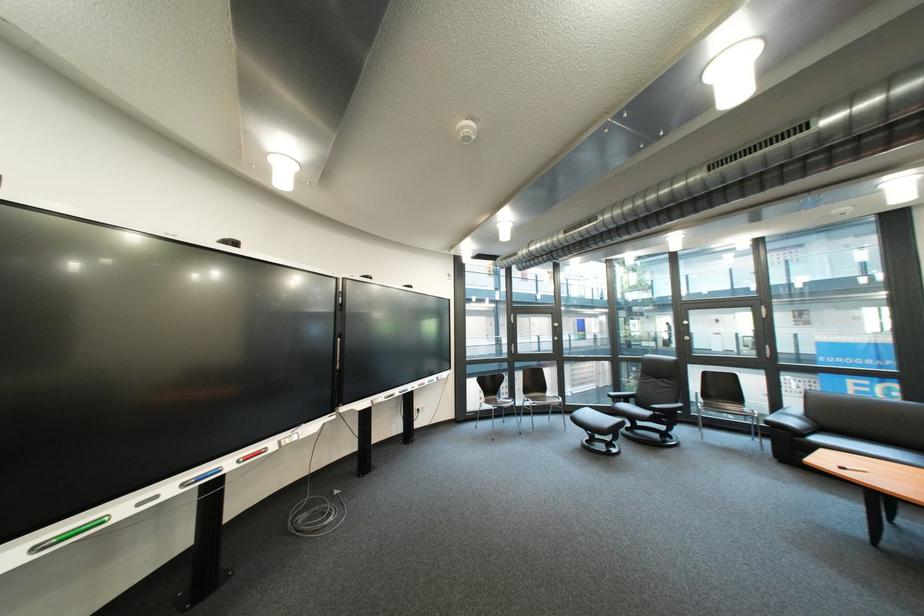
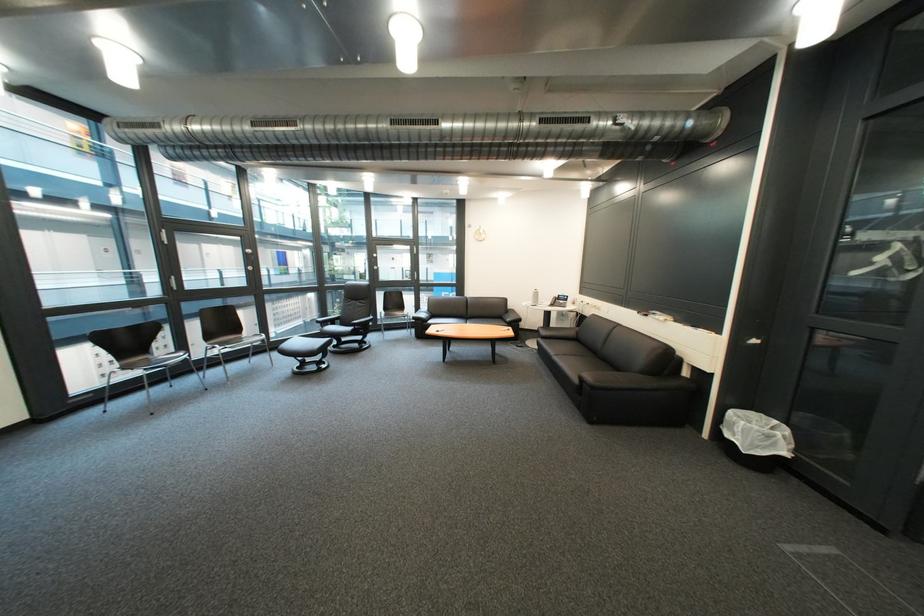
In the second image, find the point that corresponds to [602,416] in the first image.

(311, 345)